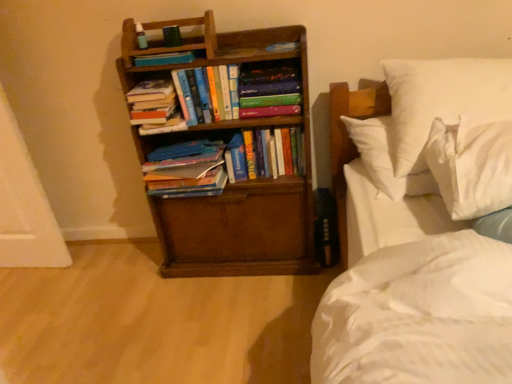
Where is `free space above hardcover books at center, the third book from the left (from a real-world perspective)`? free space above hardcover books at center, the third book from the left (from a real-world perspective) is located at coordinates (203, 61).